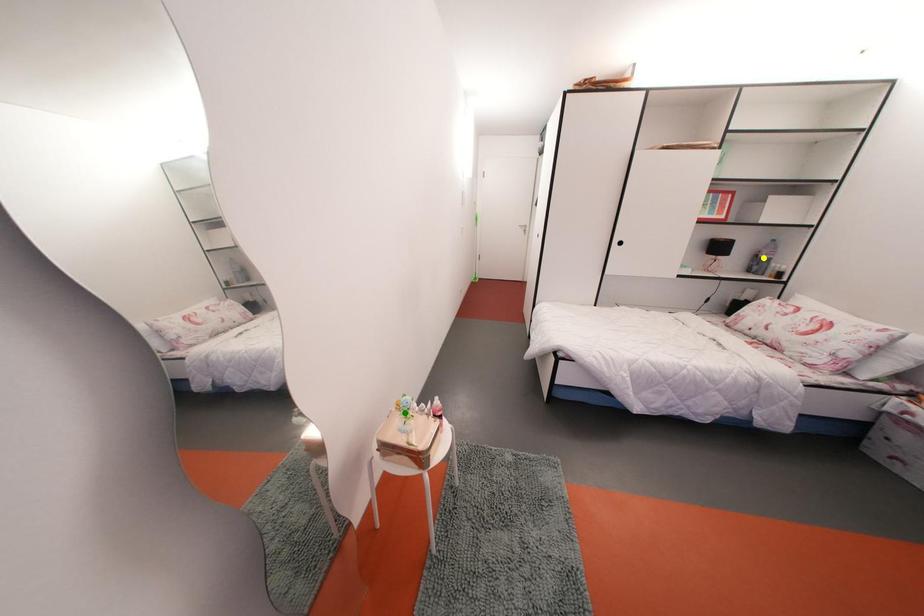
Order these from nearest to farthest:
yellow point | green point | orange point

1. green point
2. orange point
3. yellow point